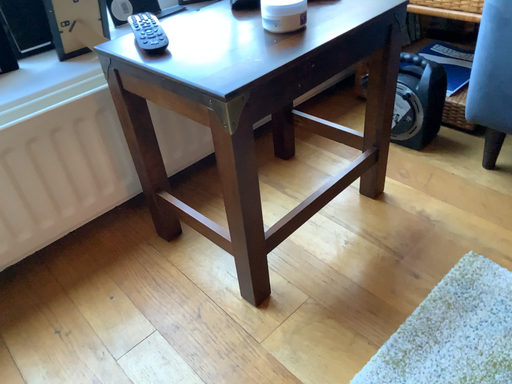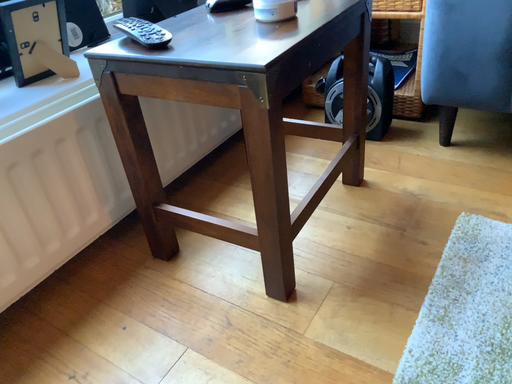
Question: Which way did the camera rotate in the video?

Choices:
 (A) rotated left
 (B) rotated right

Answer: (B)